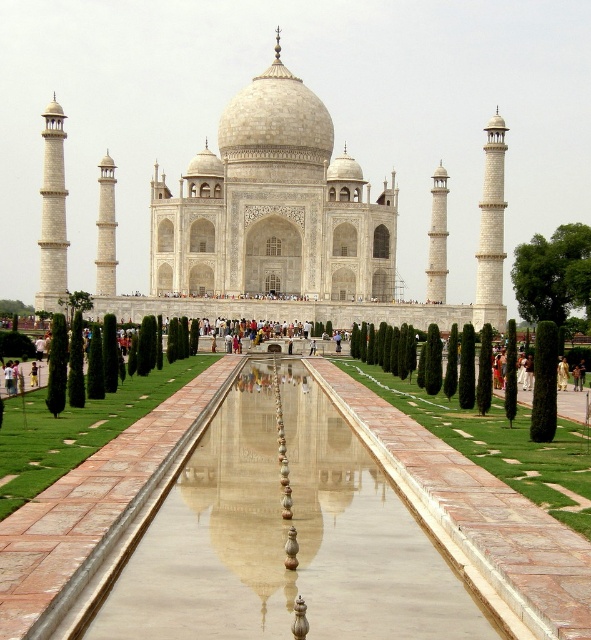
Question: Does smooth stone water at center have a greater width compared to white marble taj mahal at center?

Choices:
 (A) no
 (B) yes

Answer: (A)

Question: Does smooth stone water at center appear on the right side of white marble taj mahal at center?

Choices:
 (A) no
 (B) yes

Answer: (B)

Question: Which of the following is the closest to the observer?

Choices:
 (A) white marble taj mahal at center
 (B) smooth stone water at center

Answer: (B)

Question: Can you confirm if smooth stone water at center is bigger than white marble taj mahal at center?

Choices:
 (A) no
 (B) yes

Answer: (A)

Question: Which point is farther to the camera?

Choices:
 (A) white marble taj mahal at center
 (B) smooth stone water at center

Answer: (A)